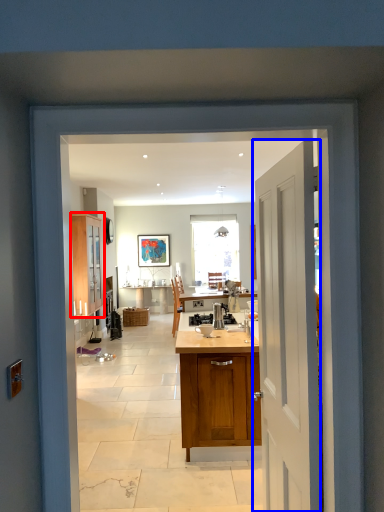
Question: Which object appears farthest to the camera in this image, cabinetry (highlighted by a red box) or door (highlighted by a blue box)?

Choices:
 (A) cabinetry
 (B) door

Answer: (A)